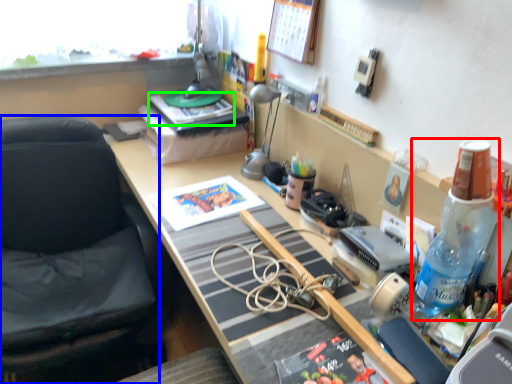
Question: Considering the real-world distances, which object is farthest from bottle (highlighted by a red box)? chair (highlighted by a blue box) or book (highlighted by a green box)?

Choices:
 (A) chair
 (B) book

Answer: (A)